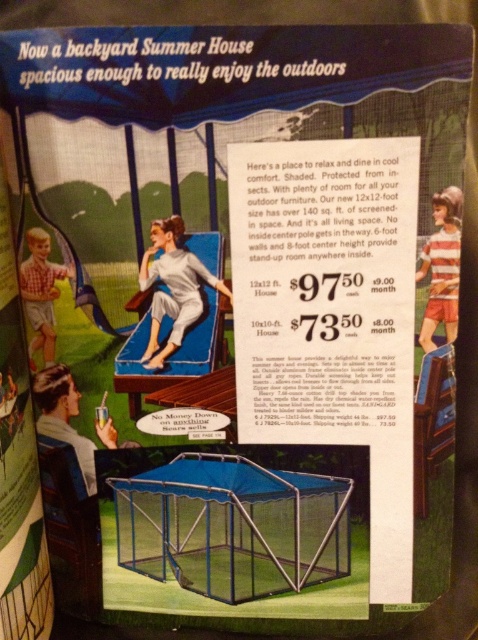
Question: Which of these objects is positioned closest to the blue mesh cage at center?

Choices:
 (A) matte white lounge chair at center
 (B) striped fabric shirt at upper right

Answer: (A)

Question: Which object is closer to the camera taking this photo?

Choices:
 (A) striped fabric shirt at upper right
 (B) blue mesh cage at center

Answer: (A)

Question: Is the position of blue mesh cage at center more distant than that of matte white lounge chair at center?

Choices:
 (A) yes
 (B) no

Answer: (A)

Question: Can you confirm if blue mesh cage at center is positioned to the right of matte white lounge chair at center?

Choices:
 (A) yes
 (B) no

Answer: (A)

Question: Which object appears farthest from the camera in this image?

Choices:
 (A) blue mesh cage at center
 (B) striped fabric shirt at upper right
 (C) matte white lounge chair at center

Answer: (A)

Question: Is blue mesh cage at center to the left of matte white lounge chair at center from the viewer's perspective?

Choices:
 (A) yes
 (B) no

Answer: (B)